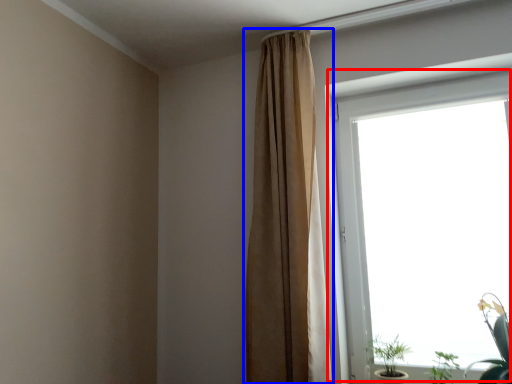
Question: Which point is further to the camera, window (highlighted by a red box) or curtain (highlighted by a blue box)?

Choices:
 (A) window
 (B) curtain

Answer: (B)